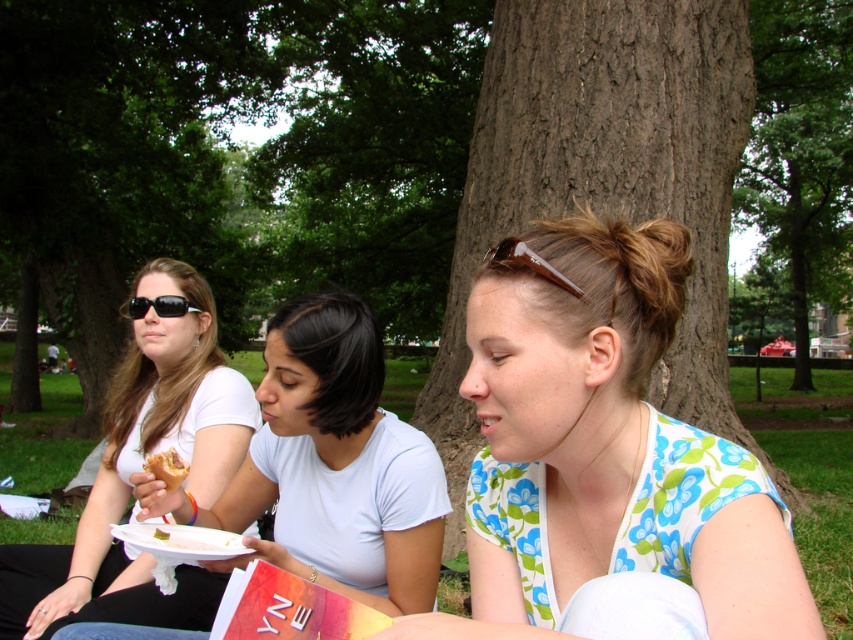
Question: Which point is farther to the camera?

Choices:
 (A) white matte shirt at center
 (B) brown plastic sunglasses at center
 (C) green leafy tree at center

Answer: (C)

Question: Can you confirm if floral print blouse at center is positioned below brown plastic sunglasses at center?

Choices:
 (A) no
 (B) yes

Answer: (B)

Question: Which point appears farthest from the camera in this image?

Choices:
 (A) (175, 285)
 (B) (184, 472)
 (C) (828, 284)
 (D) (544, 266)

Answer: (C)

Question: Which of the following is the closest to the observer?

Choices:
 (A) matte plastic sandwich at center
 (B) golden bread at center
 (C) white matte shirt at center
 (D) green leafy tree at center

Answer: (A)

Question: Considering the relative positions of floral print blouse at center and green leafy tree at center in the image provided, where is floral print blouse at center located with respect to green leafy tree at center?

Choices:
 (A) above
 (B) below

Answer: (B)

Question: Is brown plastic sunglasses at center above matte black sunglasses at upper left?

Choices:
 (A) yes
 (B) no

Answer: (B)